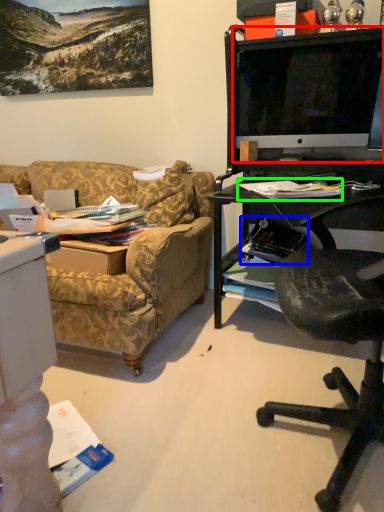
Question: Which object is positioned farthest from television (highlighted by a red box)? Select from magazine (highlighted by a blue box) and magazine (highlighted by a green box).

Choices:
 (A) magazine
 (B) magazine

Answer: (A)